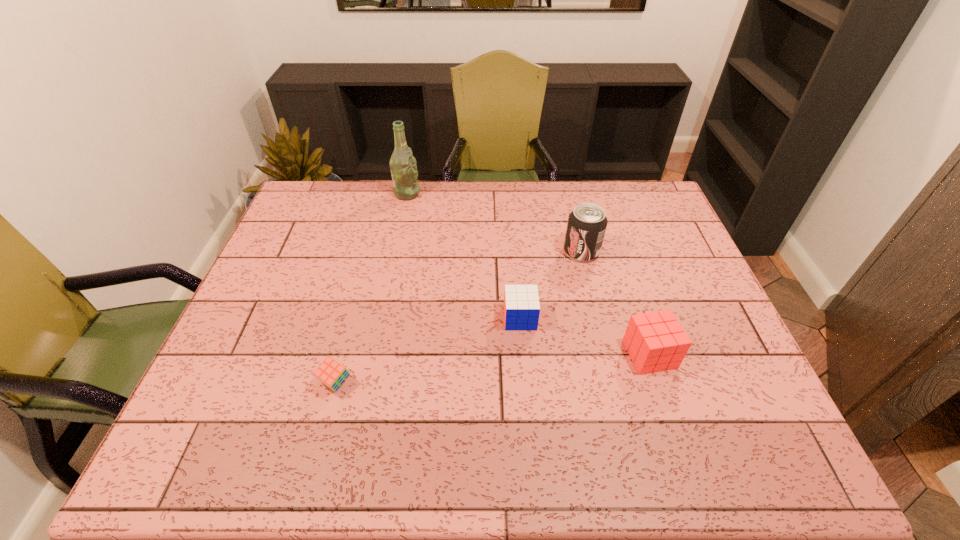
You are a GUI agent. You are given a task and a screenshot of the screen. Output one action in this format:
    pyautogui.click(x=<x>, y=<y>)
    Task: Click on the blank region between the farthest cube and the rightmost cube
    
    Given the screenshot: What is the action you would take?
    click(x=585, y=336)

I want to click on empty space between the rightmost cube and the second cube from left to right, so pos(585,336).

Image resolution: width=960 pixels, height=540 pixels. Find the location of `blank region between the farthest object and the leftmost cube`. blank region between the farthest object and the leftmost cube is located at coordinates (372, 288).

Point out which object is positioned as the third nearest to the fourth nearest object. Please provide its 2D coordinates. Your answer should be formatted as a tuple, i.e. [(x, y)], where the tuple contains the x and y coordinates of a point satisfying the conditions above.

[(404, 173)]

Find the location of `object that ranks as the third closest to the second farthest object`. object that ranks as the third closest to the second farthest object is located at coordinates (404, 173).

Find the location of a particular element. This screenshot has width=960, height=540. cube object that ranks as the closest to the third object from right to left is located at coordinates (655, 341).

Locate an element on the screen. Image resolution: width=960 pixels, height=540 pixels. the closest cube to the third tallest object is located at coordinates (521, 302).

You are a GUI agent. You are given a task and a screenshot of the screen. Output one action in this format:
    pyautogui.click(x=<x>, y=<y>)
    Task: Click on the free location that satisfies the following two spatial constraints: 1. on the surface of the rightmost cube; 2. on the right side of the beer bottle
    This screenshot has width=960, height=540.
    Given the screenshot: What is the action you would take?
    pyautogui.click(x=374, y=354)

Image resolution: width=960 pixels, height=540 pixels. What are the coordinates of `vacant area in the image that satisfies the following two spatial constraints: 1. on the back side of the soda can; 2. on the surface of the farthest object` in the screenshot? It's located at coord(567,193).

The image size is (960, 540). What are the coordinates of `free space in the image that satisfies the following two spatial constraints: 1. on the back side of the rightmost cube; 2. on the surface of the farthest object` in the screenshot? It's located at click(x=597, y=193).